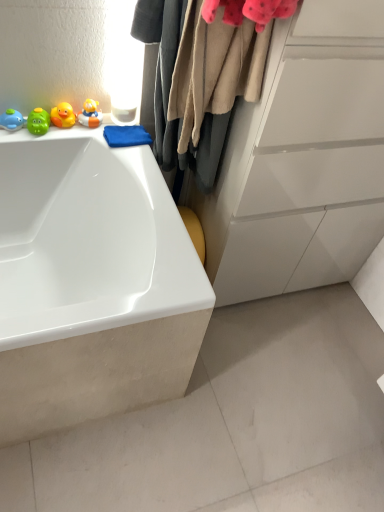
The image size is (384, 512). Find the location of `vacant region in front of blue microfiber cloth at upper left`. vacant region in front of blue microfiber cloth at upper left is located at coordinates (134, 165).